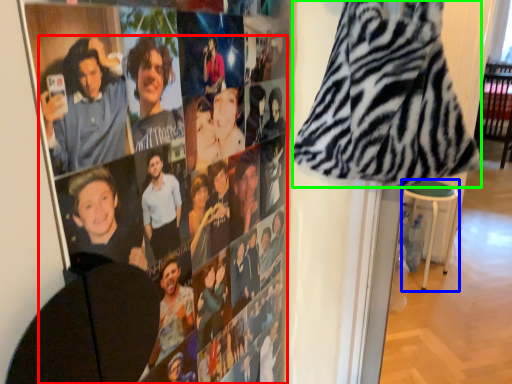
Question: Estimate the real-world distances between objects in this image. Which object is farther from person (highlighted by a red box), bar stool (highlighted by a blue box) or blanket (highlighted by a green box)?

Choices:
 (A) bar stool
 (B) blanket

Answer: (A)